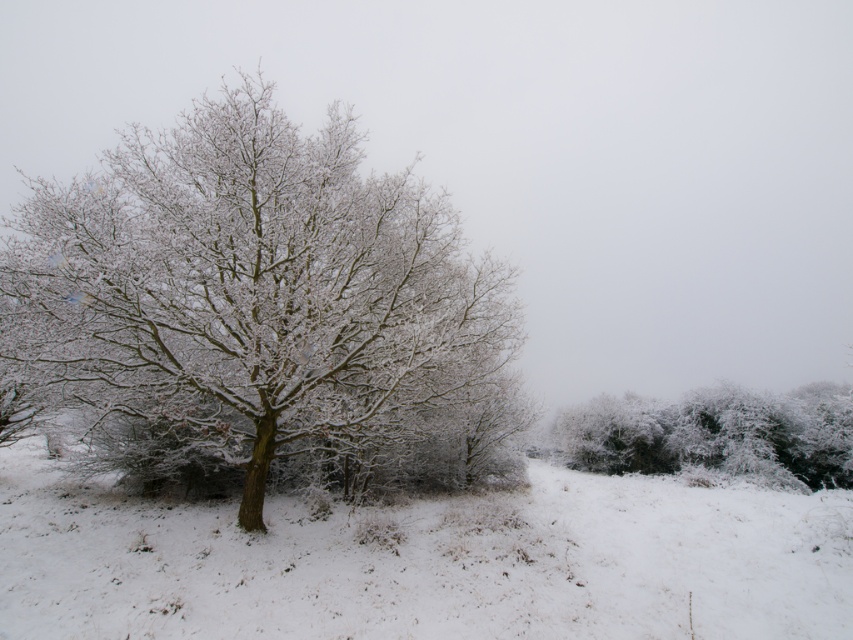
Question: Which point is closer to the camera taking this photo?

Choices:
 (A) (376, 540)
 (B) (653, 417)
 (C) (306, 364)

Answer: (C)

Question: Is frosted bark tree at center to the left of white frosty bush at right from the viewer's perspective?

Choices:
 (A) no
 (B) yes

Answer: (B)

Question: Is white fluffy snow at center thinner than white frosty bush at right?

Choices:
 (A) no
 (B) yes

Answer: (A)

Question: Is frosted bark tree at center to the left of white frosty bush at right from the viewer's perspective?

Choices:
 (A) no
 (B) yes

Answer: (B)

Question: Which point is closer to the camera?

Choices:
 (A) white fluffy snow at center
 (B) white frosty bush at right

Answer: (A)

Question: Among these objects, which one is farthest from the camera?

Choices:
 (A) frosted bark tree at center
 (B) white fluffy snow at center
 (C) white frosty bush at right

Answer: (C)